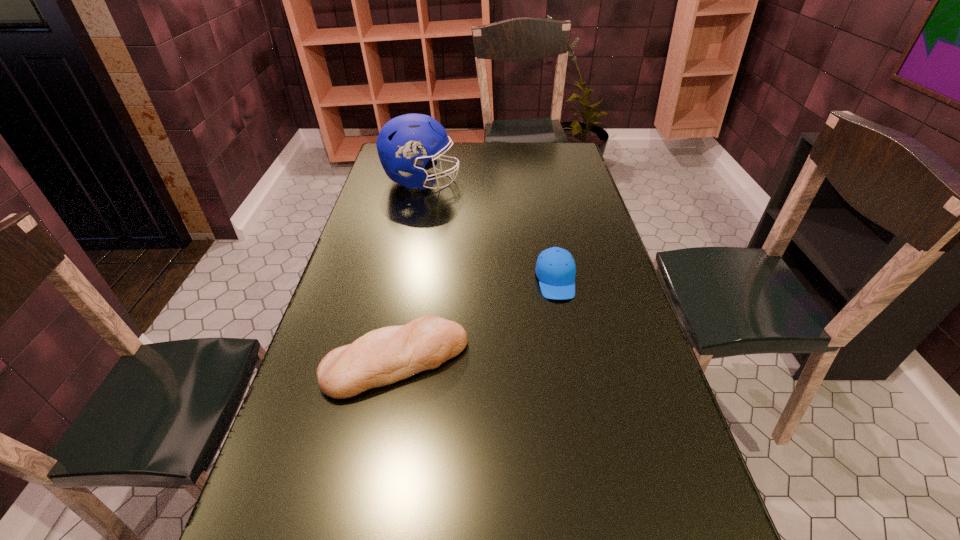
Image resolution: width=960 pixels, height=540 pixels. I want to click on bread that is at the left edge, so click(x=381, y=357).

This screenshot has height=540, width=960. Identify the location of object that is at the right edge. (555, 269).

You are a GUI agent. You are given a task and a screenshot of the screen. Output one action in this format:
    pyautogui.click(x=<x>, y=<y>)
    Task: Click on the object at the far left corner
    Image resolution: width=960 pixels, height=540 pixels.
    Given the screenshot: What is the action you would take?
    pyautogui.click(x=403, y=144)

Find the location of `vacant space at the far edge of the desktop`. vacant space at the far edge of the desktop is located at coordinates (523, 152).

Identify the location of blank space at the left edge of the desktop. (381, 312).

In the image, there is a desktop. Where is `free space at the right edge`? Image resolution: width=960 pixels, height=540 pixels. free space at the right edge is located at coordinates (584, 207).

You are a GUI agent. You are given a task and a screenshot of the screen. Output one action in this format:
    pyautogui.click(x=<x>, y=<y>)
    Task: Click on the vacant space at the far right corner
    The height and width of the screenshot is (540, 960).
    Given the screenshot: What is the action you would take?
    pyautogui.click(x=563, y=145)

Locate an element on the screen. The width and height of the screenshot is (960, 540). free point between the nearest object and the cap is located at coordinates (476, 321).

What are the coordinates of `free space between the tallest object and the rightmost object` in the screenshot? It's located at (489, 231).

The height and width of the screenshot is (540, 960). What are the coordinates of `vacant area that lies between the rightmost object and the nearest object` in the screenshot? It's located at (476, 321).